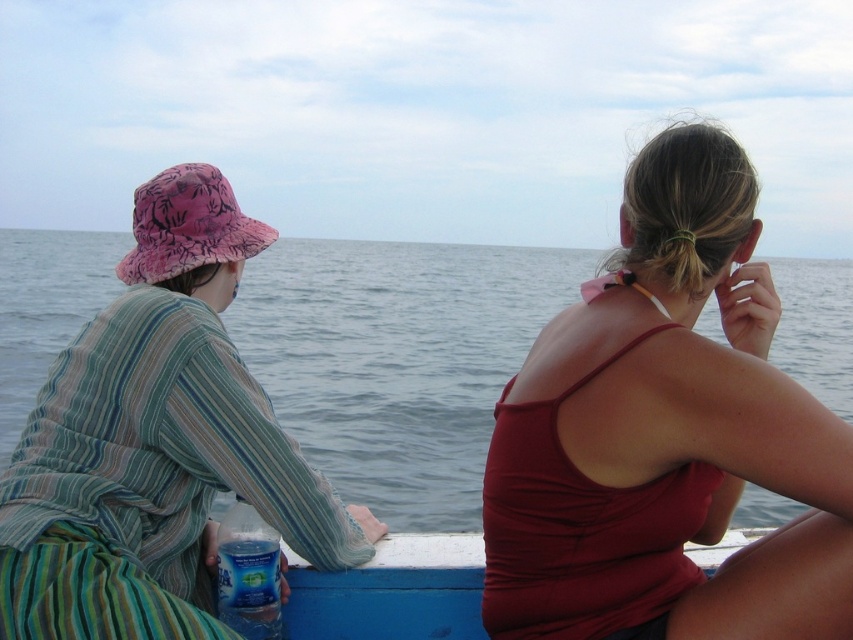
Question: Where is blue water at center located in relation to blue painted wood boat at lower center in the image?

Choices:
 (A) below
 (B) above

Answer: (B)

Question: Which point is farther from the camera taking this photo?

Choices:
 (A) (395, 525)
 (B) (463, 604)
 (C) (82, 340)
 (D) (706, 593)

Answer: (A)

Question: Which object is closer to the camera taking this photo?

Choices:
 (A) striped cotton shirt at left
 (B) blue water at center
 (C) pink fabric hat at left
 (D) matte red tank top at center

Answer: (D)

Question: Can you confirm if blue water at center is smaller than blue painted wood boat at lower center?

Choices:
 (A) yes
 (B) no

Answer: (B)

Question: Estimate the real-world distances between objects in this image. Which object is farther from the striped cotton shirt at left?

Choices:
 (A) blue painted wood boat at lower center
 (B) pink fabric hat at left

Answer: (B)

Question: Is blue water at center positioned in front of blue painted wood boat at lower center?

Choices:
 (A) yes
 (B) no

Answer: (A)